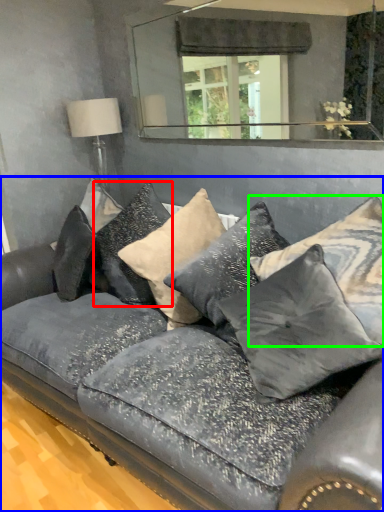
Question: Which is nearer to the pillow (highlighted by a red box)? studio couch (highlighted by a blue box) or pillow (highlighted by a green box).

Choices:
 (A) studio couch
 (B) pillow

Answer: (A)